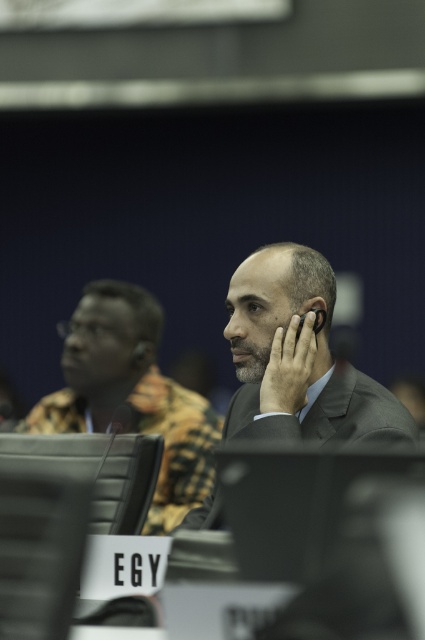
Does matte gray suit at center have a larger size compared to matte black suit at center?

Incorrect, matte gray suit at center is not larger than matte black suit at center.

Who is shorter, matte gray suit at center or matte black suit at center?

matte gray suit at center is shorter.

Who is more distant from viewer, (357, 400) or (192, 492)?

The point (192, 492) is behind.

Identify the location of matte gray suit at center. (297, 356).